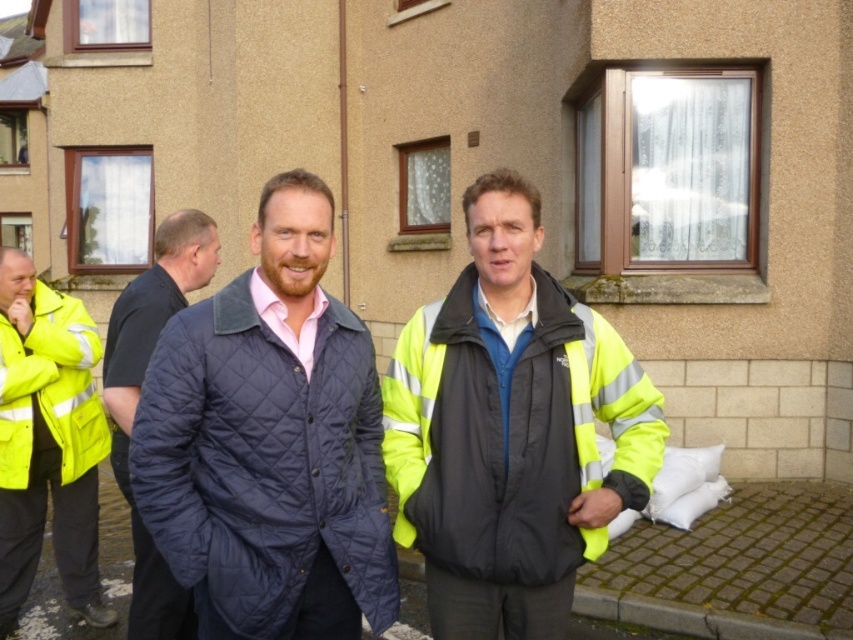
Which is in front, point (328, 385) or point (450, 333)?

Point (328, 385)

Can you confirm if navy quilted jacket at center is positioned to the right of high visibility fabric jacket at center?

Incorrect, navy quilted jacket at center is not on the right side of high visibility fabric jacket at center.

You are a GUI agent. You are given a task and a screenshot of the screen. Output one action in this format:
    pyautogui.click(x=<x>, y=<y>)
    Task: Click on the navy quilted jacket at center
    
    Given the screenshot: What is the action you would take?
    pyautogui.click(x=263, y=465)

This screenshot has height=640, width=853. I want to click on navy quilted jacket at center, so click(x=263, y=465).

What do you see at coordinates (512, 436) in the screenshot?
I see `high visibility fabric jacket at center` at bounding box center [512, 436].

You are a GUI agent. You are given a task and a screenshot of the screen. Output one action in this format:
    pyautogui.click(x=<x>, y=<y>)
    Task: Click on the high visibility fabric jacket at center
    
    Given the screenshot: What is the action you would take?
    pyautogui.click(x=512, y=436)

Can you confirm if high visibility fabric jacket at center is positioned above dark blue quilted jacket at left?

Indeed, high visibility fabric jacket at center is positioned over dark blue quilted jacket at left.

Can you confirm if high visibility fabric jacket at center is wider than dark blue quilted jacket at left?

Indeed, high visibility fabric jacket at center has a greater width compared to dark blue quilted jacket at left.

Between point (392, 428) and point (125, 369), which one is positioned behind?

Point (125, 369)

Where is `high visibility fabric jacket at center`? This screenshot has height=640, width=853. high visibility fabric jacket at center is located at coordinates (512, 436).